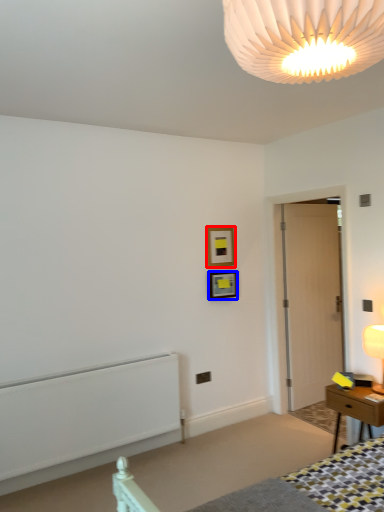
Question: Which of the following is the farthest to the observer, picture frame (highlighted by a red box) or picture frame (highlighted by a blue box)?

Choices:
 (A) picture frame
 (B) picture frame

Answer: (A)